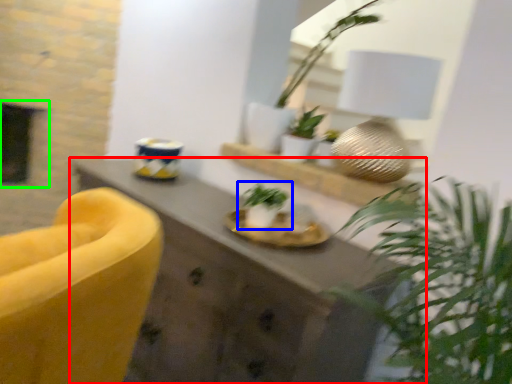
Question: Considering the real-world distances, which object is closest to desk (highlighted by a red box)? houseplant (highlighted by a blue box) or fireplace (highlighted by a green box).

Choices:
 (A) houseplant
 (B) fireplace

Answer: (A)